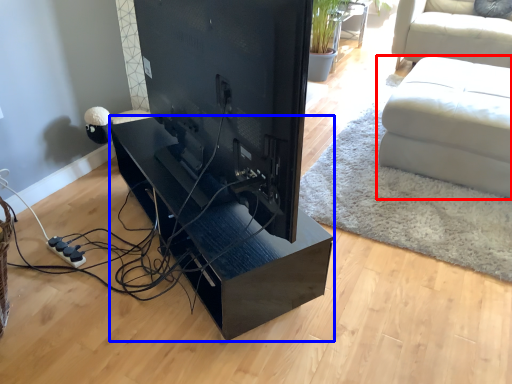
Question: Among these objects, which one is farthest to the camera, studio couch (highlighted by a red box) or table (highlighted by a blue box)?

Choices:
 (A) studio couch
 (B) table

Answer: (A)